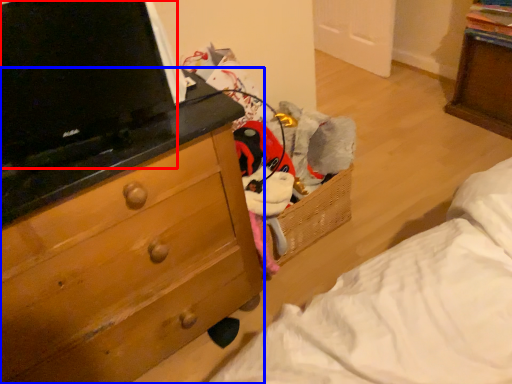
Question: Which object is closer to the camera taking this photo, computer (highlighted by a red box) or chest of drawers (highlighted by a blue box)?

Choices:
 (A) computer
 (B) chest of drawers

Answer: (B)